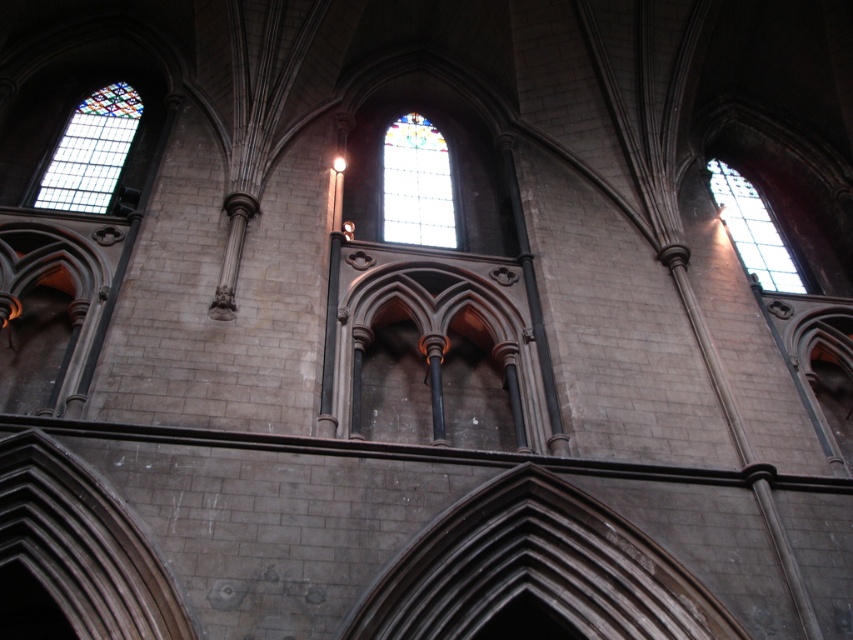
Between stained glass window at center and stained glass window at upper right, which one appears on the right side from the viewer's perspective?

From the viewer's perspective, stained glass window at upper right appears more on the right side.

Who is more forward, (445, 184) or (753, 253)?

Point (445, 184) is in front.

Locate an element on the screen. The height and width of the screenshot is (640, 853). stained glass window at center is located at coordinates (416, 184).

Which is behind, point (138, 109) or point (706, 164)?

The point (706, 164) is behind.

Where is `stained glass window at upper left`? This screenshot has height=640, width=853. stained glass window at upper left is located at coordinates (91, 150).

Is point (120, 83) closer to camera compared to point (436, 156)?

No.

Who is shorter, stained glass window at upper left or stained glass window at center?

stained glass window at upper left

Who is more distant from viewer, (100, 140) or (424, 129)?

The point (424, 129) is more distant.

In order to click on stained glass window at upper left in this screenshot , I will do `click(91, 150)`.